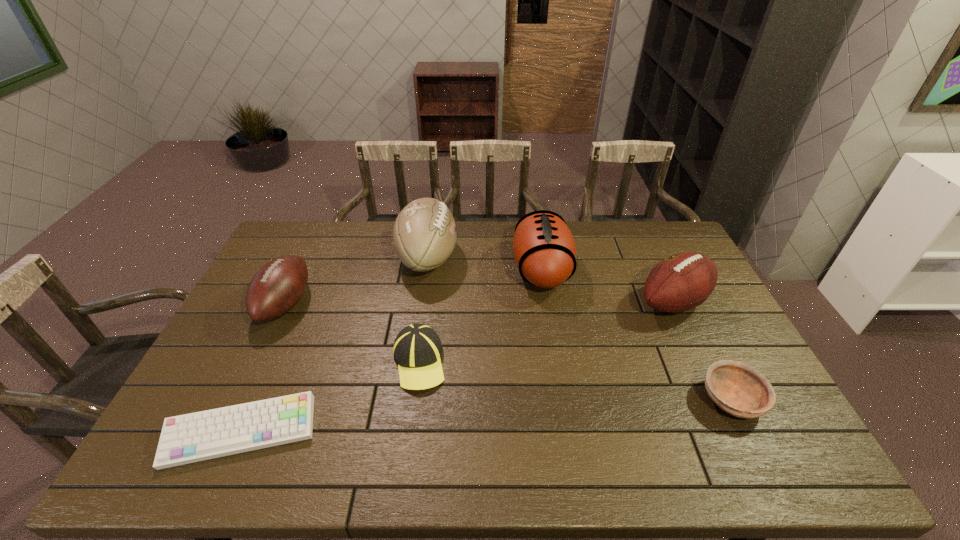
I want to click on object at the near left corner, so click(194, 437).

Locate an element on the screen. This screenshot has width=960, height=540. free spot at the far edge of the desktop is located at coordinates (587, 222).

Image resolution: width=960 pixels, height=540 pixels. What are the coordinates of `vacant region at the near edge of the desktop` in the screenshot? It's located at (324, 474).

In the image, there is a desktop. At what (x,y) coordinates should I click in order to perform the action: click on vacant space at the left edge. Please return your answer as a coordinate pair (x, y). Looking at the image, I should click on (238, 340).

This screenshot has width=960, height=540. In the image, there is a desktop. Find the location of `free space at the right edge`. free space at the right edge is located at coordinates (747, 359).

The height and width of the screenshot is (540, 960). I want to click on vacant space at the far left corner, so click(289, 246).

This screenshot has width=960, height=540. Identify the location of blank space at the near right corner. (790, 439).

At what (x,y) coordinates should I click in order to perform the action: click on free space between the rightmost football (American) and the second shortest object. Please return your answer as a coordinate pair (x, y). The image size is (960, 540). Looking at the image, I should click on (702, 351).

Locate an element on the screen. free space that is in between the third shortest object and the rightmost football (American) is located at coordinates (546, 332).

Where is `free area in between the bowl and the fifth tallest object`? The width and height of the screenshot is (960, 540). free area in between the bowl and the fifth tallest object is located at coordinates (575, 381).